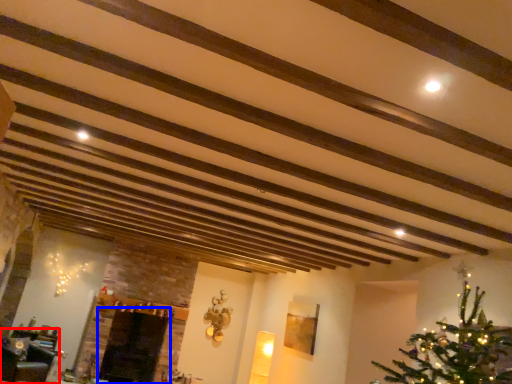
Question: Which object appears closest to the camera in this image, furniture (highlighted by a red box) or fireplace (highlighted by a blue box)?

Choices:
 (A) furniture
 (B) fireplace

Answer: (A)